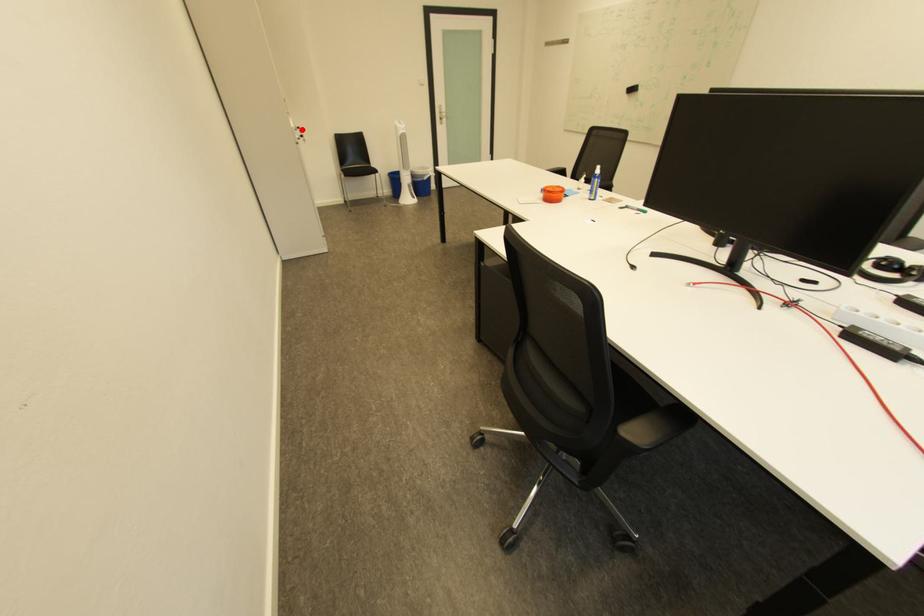
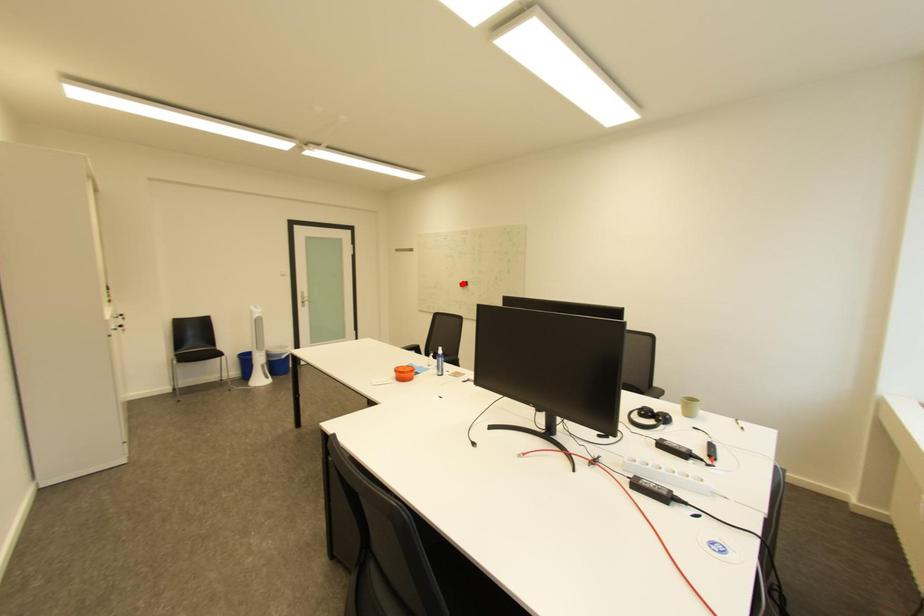
I am providing you with two images of the same scene from different viewpoints. A red point is marked on the first image and another point is marked on the second image. Are the points marked in image1 and image2 representing the same 3D position?

No